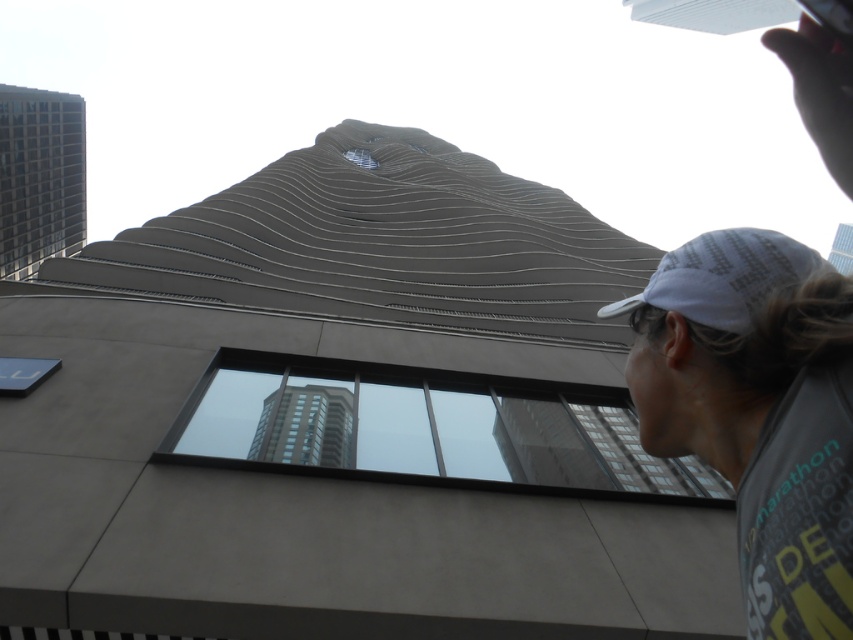
You are standing in the same position as the person in the image. You want to take a photo of the transparent glass window at center without the white fabric cap at upper right appearing in the frame. Is this possible?

The white fabric cap at upper right is closer to the viewer than the transparent glass window at center, so it will block the view of the window. Therefore, it is not possible to take a photo of the transparent glass window at center without the white fabric cap at upper right appearing in the frame.

You are standing in front of the building and want to look through the transparent glass window at center. Where should you position yourself to see the point at coordinates (424, 428) on the window?

The point at coordinates (424, 428) is located on the transparent glass window at center, so you should position yourself directly in front of the transparent glass window at center to see it.